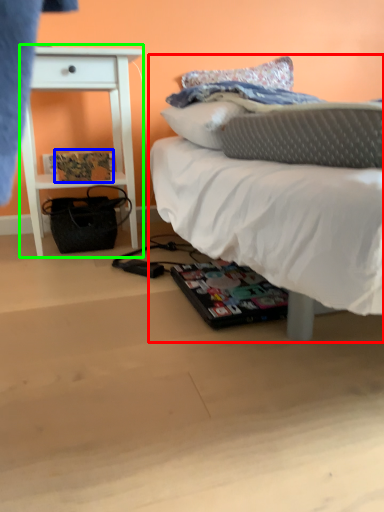
Question: Estimate the real-world distances between objects in this image. Which object is closer to bed (highlighted by a red box), magazine (highlighted by a blue box) or nightstand (highlighted by a green box)?

Choices:
 (A) magazine
 (B) nightstand

Answer: (B)